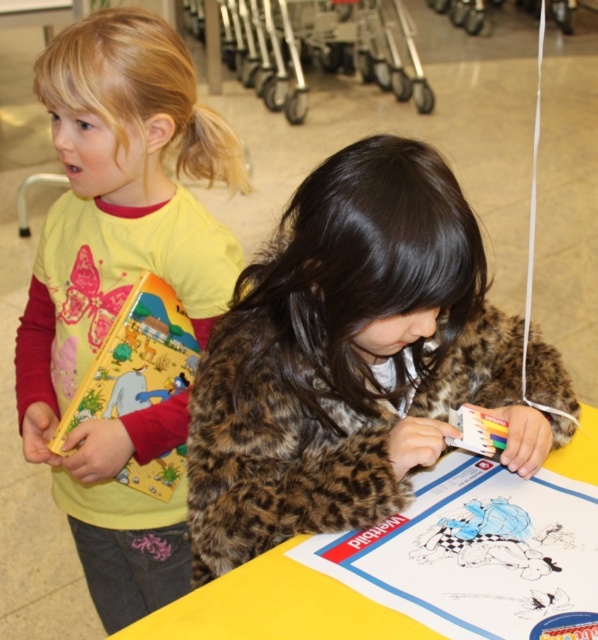
Question: Is matte yellow shirt at left to the right of yellow paper at center from the viewer's perspective?

Choices:
 (A) yes
 (B) no

Answer: (B)

Question: Which is nearer to the yellow paper at center?

Choices:
 (A) matte yellow shirt at left
 (B) leopard print jacket at center

Answer: (B)

Question: Considering the real-world distances, which object is farthest from the yellow paper at center?

Choices:
 (A) matte yellow shirt at left
 (B) leopard print jacket at center

Answer: (A)

Question: Among these objects, which one is farthest from the camera?

Choices:
 (A) leopard print jacket at center
 (B) yellow paper at center
 (C) matte yellow shirt at left

Answer: (C)

Question: Is leopard print jacket at center smaller than yellow paper at center?

Choices:
 (A) yes
 (B) no

Answer: (B)

Question: Does leopard print jacket at center have a greater width compared to yellow paper at center?

Choices:
 (A) yes
 (B) no

Answer: (A)